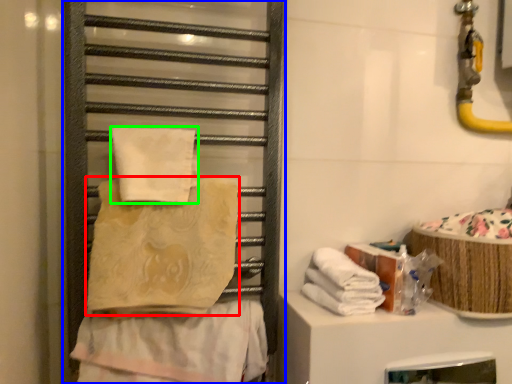
Question: Which object is the closest to the towel (highlighted by a red box)? Choose among these: cage (highlighted by a blue box) or towel (highlighted by a green box).

Choices:
 (A) cage
 (B) towel

Answer: (B)